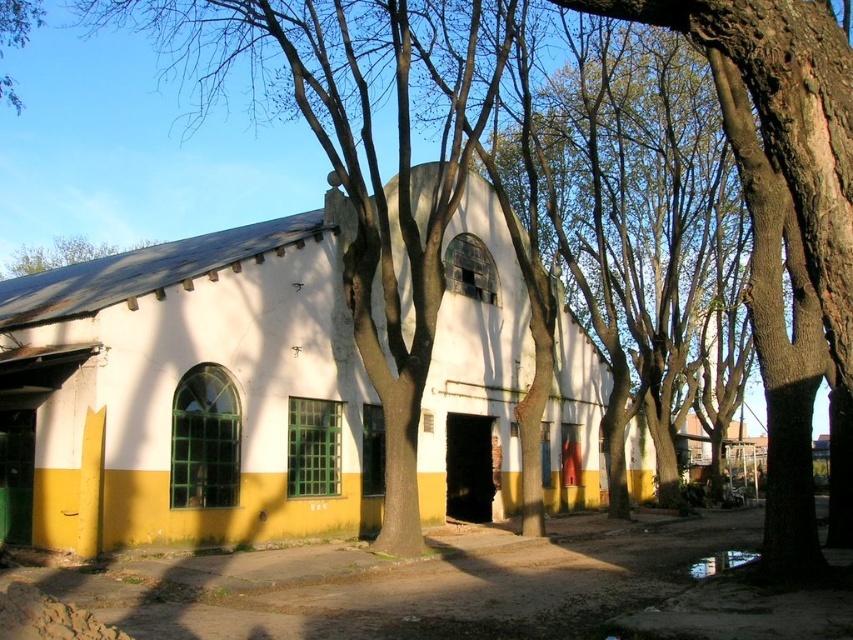
Question: Is white matte building at center thinner than brown bark tree at upper left?

Choices:
 (A) yes
 (B) no

Answer: (A)

Question: Which object is closer to the camera taking this photo?

Choices:
 (A) rough bark tree at center
 (B) white matte building at center
 (C) green leafy tree at upper left
 (D) brown bark tree at upper left

Answer: (A)

Question: Does white matte building at center appear on the left side of brown bark tree at upper left?

Choices:
 (A) no
 (B) yes

Answer: (A)

Question: Is white matte building at center to the right of brown bark tree at upper left from the viewer's perspective?

Choices:
 (A) yes
 (B) no

Answer: (A)

Question: Which object is positioned farthest from the green leafy tree at upper left?

Choices:
 (A) rough bark tree at center
 (B) white matte building at center

Answer: (A)

Question: Which of the following is the farthest from the observer?

Choices:
 (A) rough bark tree at center
 (B) brown bark tree at upper left

Answer: (B)